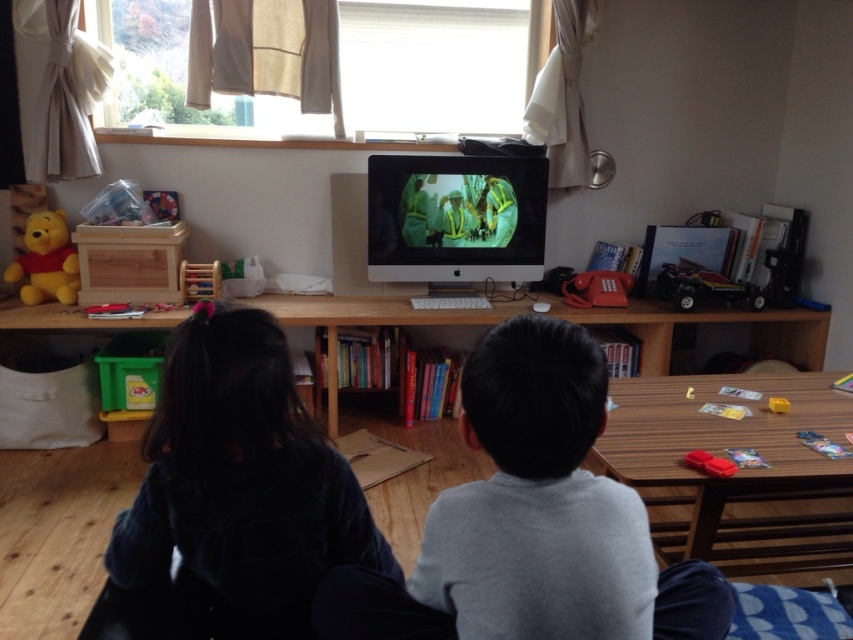
Question: In this image, where is dark blue velvet at lower left located relative to wooden bookshelf at center?

Choices:
 (A) above
 (B) below

Answer: (B)

Question: Which point is closer to the camera?

Choices:
 (A) dark blue velvet at lower left
 (B) black plastic toy car at right
 (C) matte yellow plush bear at left
 (D) wooden bookshelf at center

Answer: (A)

Question: Among these points, which one is farthest from the camera?

Choices:
 (A) (38, 228)
 (B) (126, 563)
 (C) (724, 442)

Answer: (A)

Question: Which point appears farthest from the camera in this image?

Choices:
 (A) (670, 492)
 (B) (399, 323)
 (C) (709, 285)

Answer: (C)

Question: Can you confirm if wooden table at lower center is thinner than wooden bookshelf at center?

Choices:
 (A) yes
 (B) no

Answer: (A)

Question: Is dark blue velvet at lower left wider than wooden bookshelf at center?

Choices:
 (A) yes
 (B) no

Answer: (B)